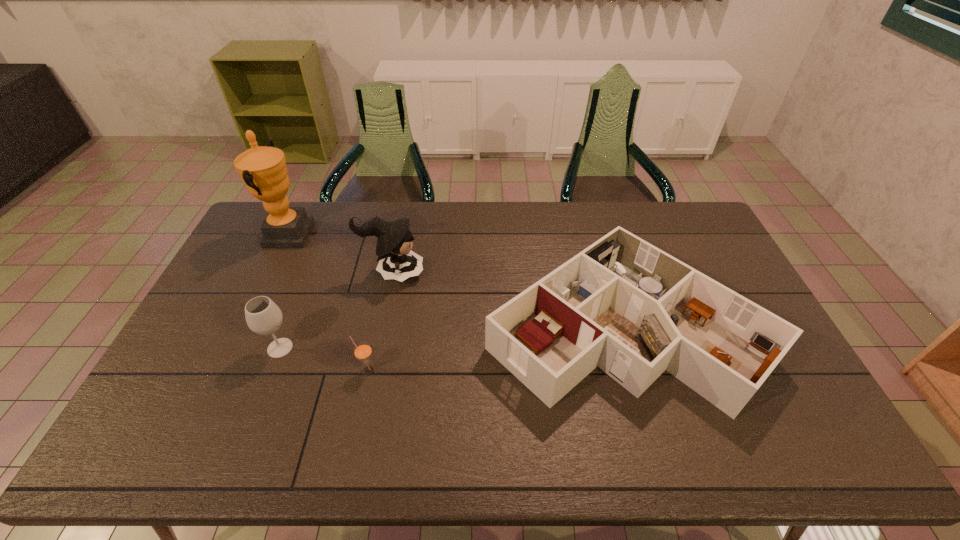
Find the location of a particular element. Image resolution: width=960 pixels, height=540 pixels. empty space that is in between the award and the straw is located at coordinates pos(327,302).

Find the location of `vacant point located between the farthest object and the doll`. vacant point located between the farthest object and the doll is located at coordinates (340, 254).

This screenshot has width=960, height=540. In order to click on object that is the fourth closest one to the farthest object in this screenshot , I will do `click(622, 304)`.

You are a GUI agent. You are given a task and a screenshot of the screen. Output one action in this format:
    pyautogui.click(x=<x>, y=<y>)
    Task: Click on the fourth closest object to the third shortest object
    The height and width of the screenshot is (540, 960).
    Given the screenshot: What is the action you would take?
    pyautogui.click(x=622, y=304)

You are a GUI agent. You are given a task and a screenshot of the screen. Output one action in this format:
    pyautogui.click(x=<x>, y=<y>)
    Task: Click on the vacant space that satisfies the following two spatial constraints: 1. at the face of the doll; 2. on the front side of the third shortest object
    
    Given the screenshot: What is the action you would take?
    pyautogui.click(x=377, y=348)

I want to click on free space that satisfies the following two spatial constraints: 1. at the front of the tallest object with handles; 2. on the back side of the straw, so click(223, 370).

Where is `blank space that satisfies the following two spatial constraints: 1. on the back side of the dollhouse; 2. at the face of the doll`? This screenshot has height=540, width=960. blank space that satisfies the following two spatial constraints: 1. on the back side of the dollhouse; 2. at the face of the doll is located at coordinates (606, 273).

Image resolution: width=960 pixels, height=540 pixels. Find the location of `free location that satisfies the following two spatial constraints: 1. on the back side of the third tallest object; 2. at the front of the farthest object with handles`. free location that satisfies the following two spatial constraints: 1. on the back side of the third tallest object; 2. at the front of the farthest object with handles is located at coordinates (324, 235).

Locate an element on the screen. The height and width of the screenshot is (540, 960). blank space that satisfies the following two spatial constraints: 1. on the back side of the dollhouse; 2. at the front of the farthest object with handles is located at coordinates (595, 235).